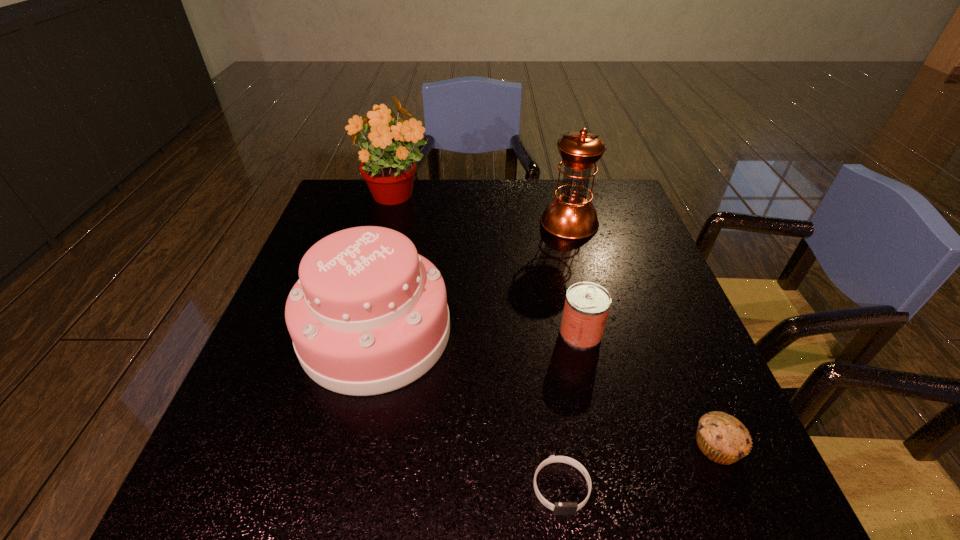
Image resolution: width=960 pixels, height=540 pixels. In order to click on flowerpot in this screenshot , I will do `click(389, 168)`.

You are a GUI agent. You are given a task and a screenshot of the screen. Output one action in this format:
    pyautogui.click(x=<x>, y=<y>)
    Task: Click on the oil lamp
    The image size is (960, 540).
    Given the screenshot: What is the action you would take?
    pyautogui.click(x=571, y=215)

You are a GUI agent. You are given a task and a screenshot of the screen. Output one action in this format:
    pyautogui.click(x=<x>, y=<y>)
    Task: Click on the fourth shortest object
    Image resolution: width=960 pixels, height=540 pixels.
    Given the screenshot: What is the action you would take?
    pyautogui.click(x=369, y=315)

Find the location of a particular element. The width and height of the screenshot is (960, 540). the third shortest object is located at coordinates (587, 304).

Where is `muffin`? This screenshot has height=540, width=960. muffin is located at coordinates (722, 438).

In order to click on the fifth tallest object in this screenshot , I will do `click(722, 438)`.

I want to click on the shortest object, so click(559, 508).

You are a GUI agent. You are given a task and a screenshot of the screen. Output one action in this format:
    pyautogui.click(x=<x>, y=<y>)
    Task: Click on the free space located 0.260m on the front of the flowerpot
    
    Given the screenshot: What is the action you would take?
    pyautogui.click(x=373, y=279)

Identify the location of vacant area located on the left of the oil lamp. (474, 222).

Locate an element on the screen. This screenshot has width=960, height=540. vacant space located 0.400m on the back of the birthday cake is located at coordinates (407, 196).